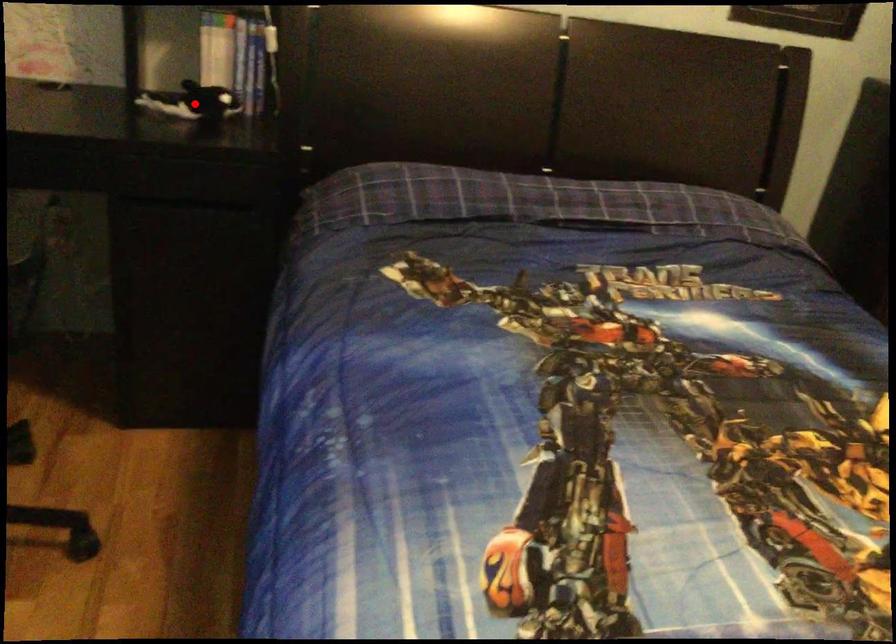
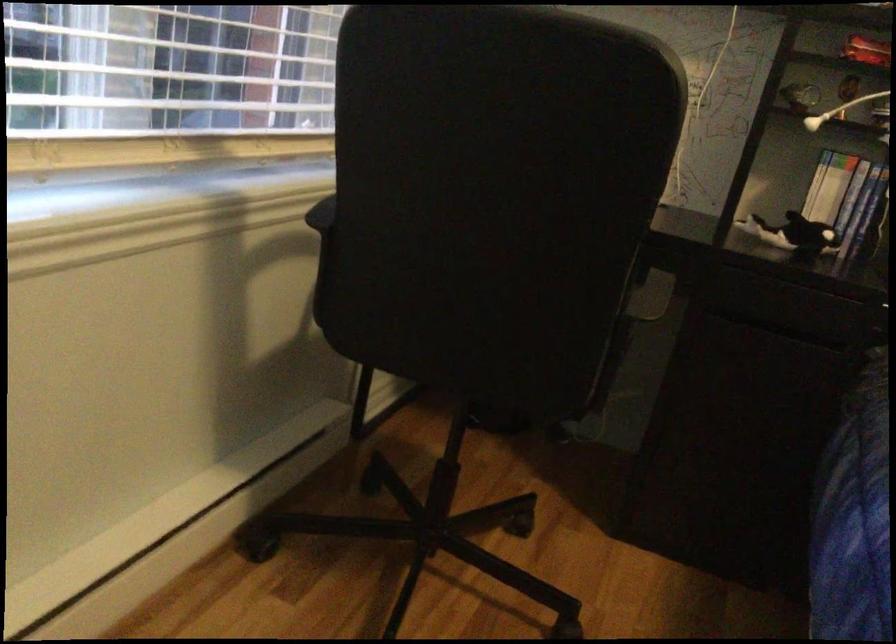
The point at the highlighted location is marked in the first image. Where is the corresponding point in the second image?

(793, 234)